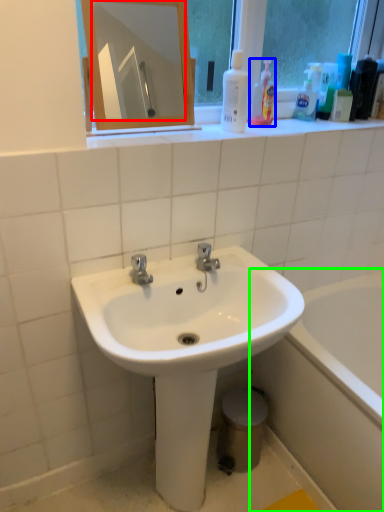
Question: Based on their relative distances, which object is nearer to mirror (highlighted by a red box)? Choose from cleaning product (highlighted by a blue box) and bathtub (highlighted by a green box).

Choices:
 (A) cleaning product
 (B) bathtub

Answer: (A)